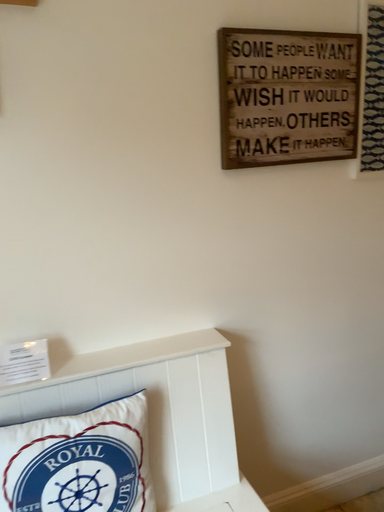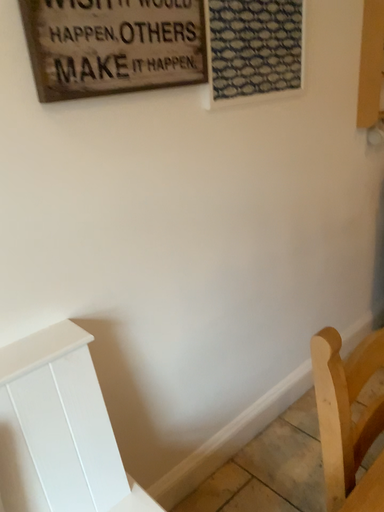
Question: How did the camera likely rotate when shooting the video?

Choices:
 (A) rotated right
 (B) rotated left

Answer: (A)